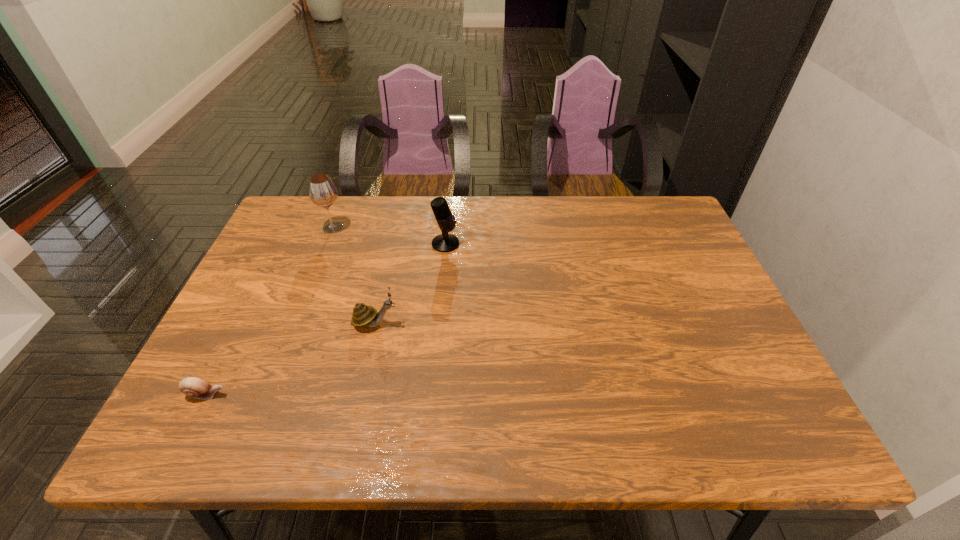
You are a GUI agent. You are given a task and a screenshot of the screen. Output one action in this format:
    pyautogui.click(x=<x>, y=<y>)
    Task: Click on the vacant area at the far right corner of the desktop
    The height and width of the screenshot is (540, 960).
    Given the screenshot: What is the action you would take?
    pyautogui.click(x=646, y=222)

You are a GUI agent. You are given a task and a screenshot of the screen. Output one action in this format:
    pyautogui.click(x=<x>, y=<y>)
    Task: Click on the vacant point at the near right corner
    The width and height of the screenshot is (960, 540).
    Given the screenshot: What is the action you would take?
    pyautogui.click(x=718, y=411)

You are a GUI agent. You are given a task and a screenshot of the screen. Output one action in this format:
    pyautogui.click(x=<x>, y=<y>)
    Task: Click on the vacant point located between the third farthest object and the wineglass
    
    Given the screenshot: What is the action you would take?
    pyautogui.click(x=354, y=275)

At what (x,y) coordinates should I click in order to perform the action: click on free spot between the third object from right to left and the rightmost object. Please return your answer as a coordinate pair (x, y). The image size is (960, 540). Looking at the image, I should click on (389, 235).

Where is `vacant area that lies between the wineglass and the microphone`? The width and height of the screenshot is (960, 540). vacant area that lies between the wineglass and the microphone is located at coordinates (389, 235).

Identify the location of vacant space that's between the nearest object and the third object from left to right. (291, 359).

Where is `empty space between the shortest object and the microphone`? The image size is (960, 540). empty space between the shortest object and the microphone is located at coordinates (325, 319).

At what (x,y) coordinates should I click in order to perform the action: click on vacant region between the third object from right to left and the leftmost object. Please return your answer as a coordinate pair (x, y). Image resolution: width=960 pixels, height=540 pixels. Looking at the image, I should click on (270, 311).

Locate an element on the screen. The width and height of the screenshot is (960, 540). free point between the right escargot and the second object from left to right is located at coordinates (354, 275).

Locate an element on the screen. The width and height of the screenshot is (960, 540). vacant space that is in between the farther escargot and the third object from right to left is located at coordinates (354, 275).